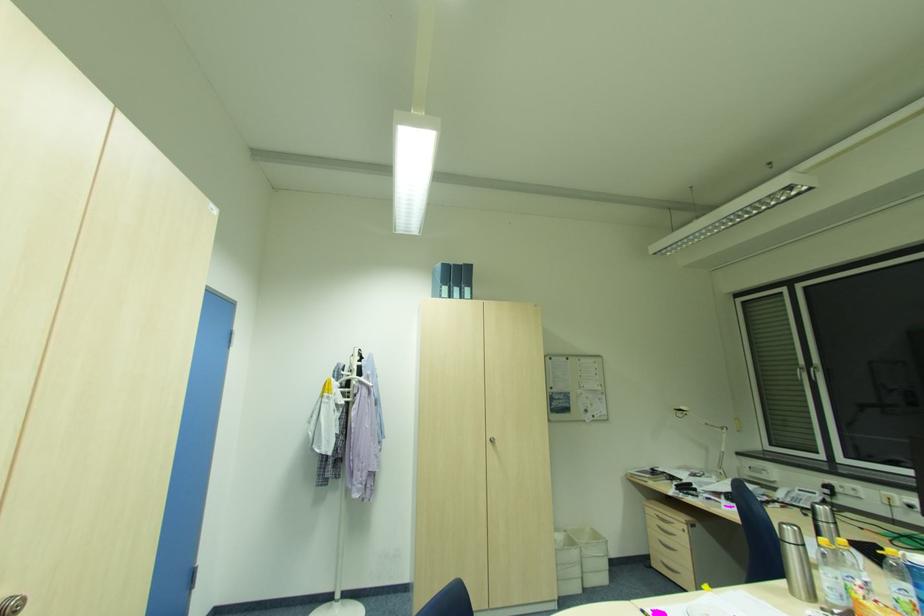
This screenshot has width=924, height=616. Find the location of `drawer handle`. drawer handle is located at coordinates (666, 520).